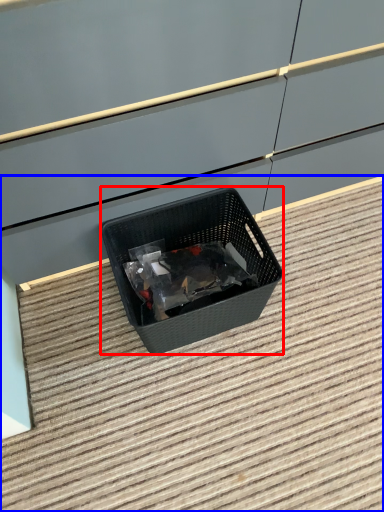
Question: Which of the following is the closest to the observer, waste container (highlighted by a red box) or stair (highlighted by a blue box)?

Choices:
 (A) waste container
 (B) stair

Answer: (B)